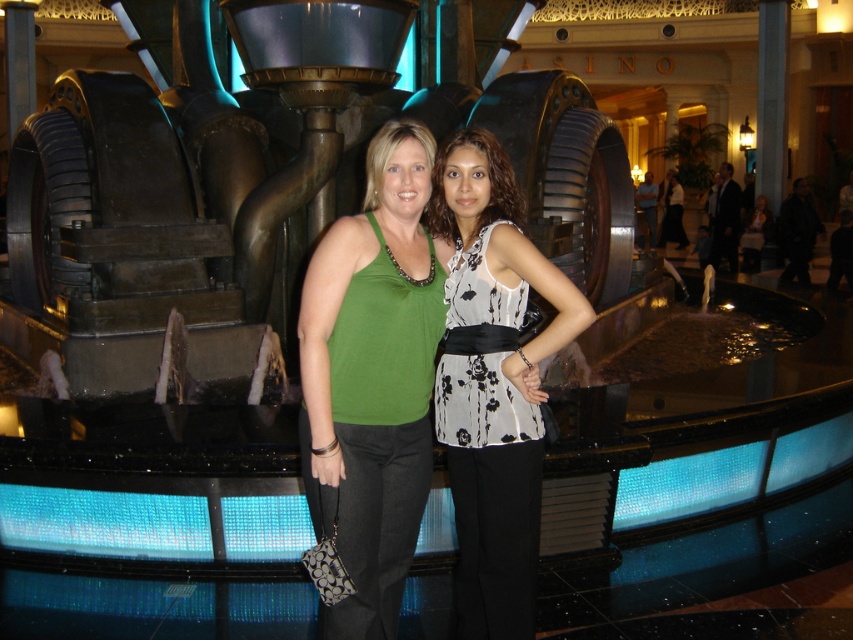
Question: Is green fabric tank top at center closer to camera compared to floral print blouse at center?

Choices:
 (A) no
 (B) yes

Answer: (B)

Question: Which point appears closest to the camera in this image?

Choices:
 (A) (337, 250)
 (B) (488, 584)

Answer: (B)

Question: Which object appears closest to the camera in this image?

Choices:
 (A) floral print blouse at center
 (B) green fabric tank top at center

Answer: (B)

Question: Does green fabric tank top at center appear on the left side of floral print blouse at center?

Choices:
 (A) no
 (B) yes

Answer: (B)

Question: Which point is farther to the camera?

Choices:
 (A) green fabric tank top at center
 (B) floral print blouse at center

Answer: (B)

Question: From the image, what is the correct spatial relationship of green fabric tank top at center in relation to floral print blouse at center?

Choices:
 (A) left
 (B) right

Answer: (A)